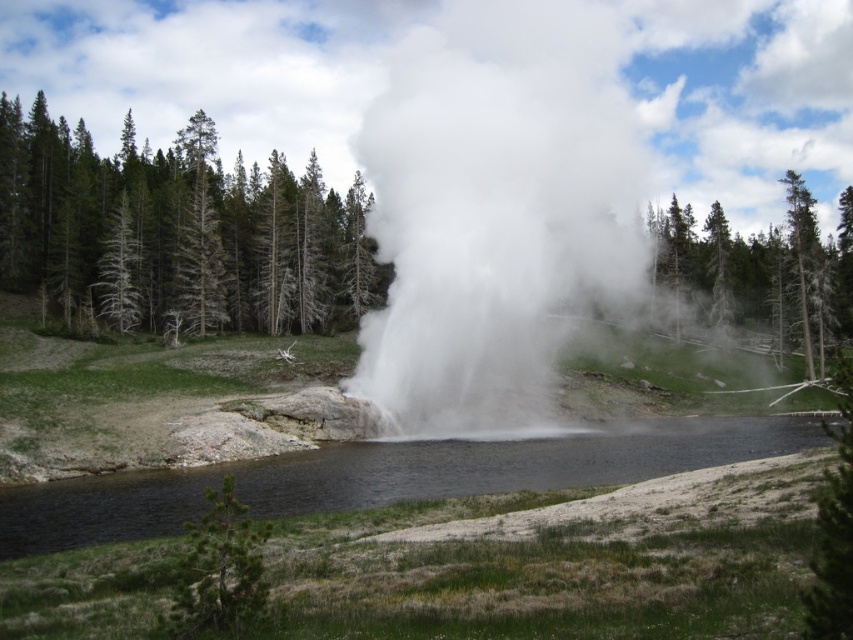
Is white vapor at center positioned before green leafy tree at upper center?

Yes, it is.

Does white vapor at center have a greater height compared to green leafy tree at upper center?

Correct, white vapor at center is much taller as green leafy tree at upper center.

Between point (442, 92) and point (717, 317), which one is positioned behind?

The point (717, 317) is behind.

Where is `white vapor at center`? white vapor at center is located at coordinates (497, 209).

Who is taller, white vapor at center or green rough bark tree at lower left?

Standing taller between the two is white vapor at center.

Between white vapor at center and green rough bark tree at lower left, which one appears on the left side from the viewer's perspective?

From the viewer's perspective, green rough bark tree at lower left appears more on the left side.

Between point (450, 289) and point (234, 509), which one is positioned in front?

Point (234, 509)

Locate an element on the screen. The width and height of the screenshot is (853, 640). white vapor at center is located at coordinates (497, 209).

Can you confirm if green textured tree at center is positioned below green leafy tree at upper center?

Actually, green textured tree at center is above green leafy tree at upper center.

Describe the element at coordinates (178, 232) in the screenshot. I see `green textured tree at center` at that location.

Locate an element on the screen. green textured tree at center is located at coordinates (178, 232).